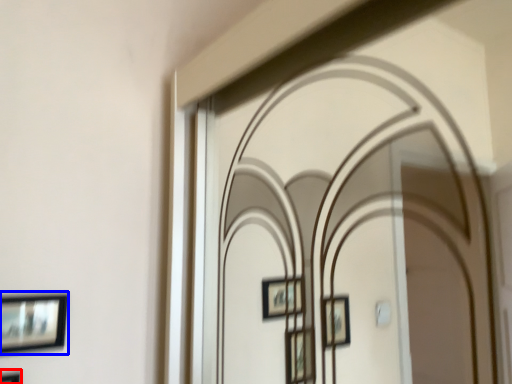
Question: Which object is further to the camera taking this photo, picture frame (highlighted by a red box) or picture frame (highlighted by a blue box)?

Choices:
 (A) picture frame
 (B) picture frame

Answer: (B)